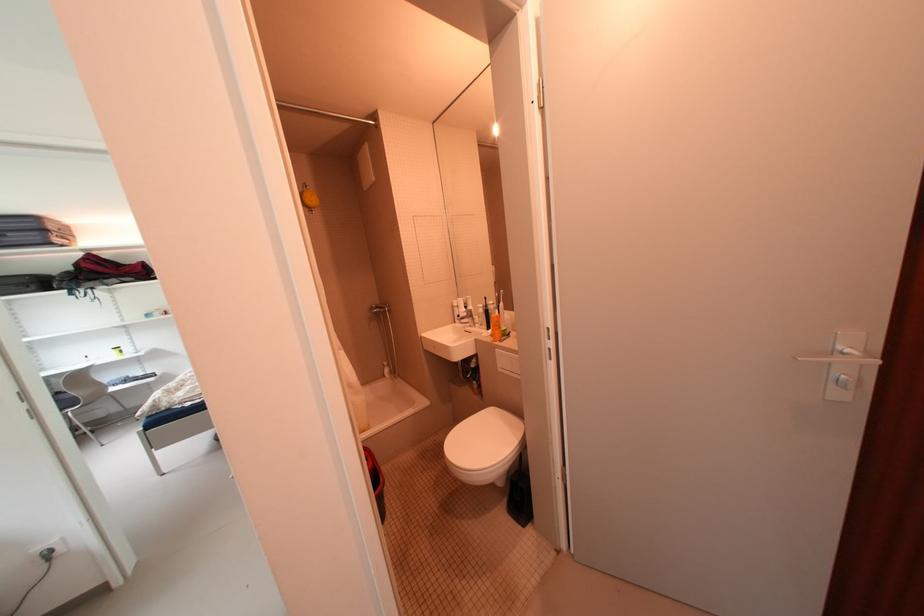
The width and height of the screenshot is (924, 616). I want to click on chair sitting surface, so click(x=67, y=402).